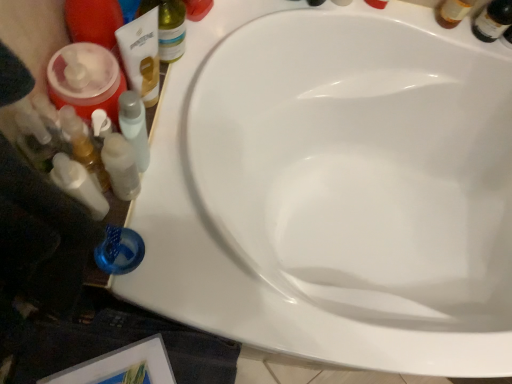
Question: Is translucent glass beer bottle at upper right spatially inside white plastic bottles at left, or outside of it?

Choices:
 (A) outside
 (B) inside

Answer: (A)

Question: From a real-world perspective, is translucent glass beer bottle at upper right physically located above or below white plastic bottles at left?

Choices:
 (A) below
 (B) above

Answer: (A)

Question: Based on their relative distances, which object is farther from the white plastic bottles at left?

Choices:
 (A) translucent plastic bottle at upper left
 (B) translucent glass beer bottle at upper right

Answer: (B)

Question: Which is nearer to the translucent plastic bottle at upper left?

Choices:
 (A) translucent glass beer bottle at upper right
 (B) white plastic bottles at left

Answer: (B)